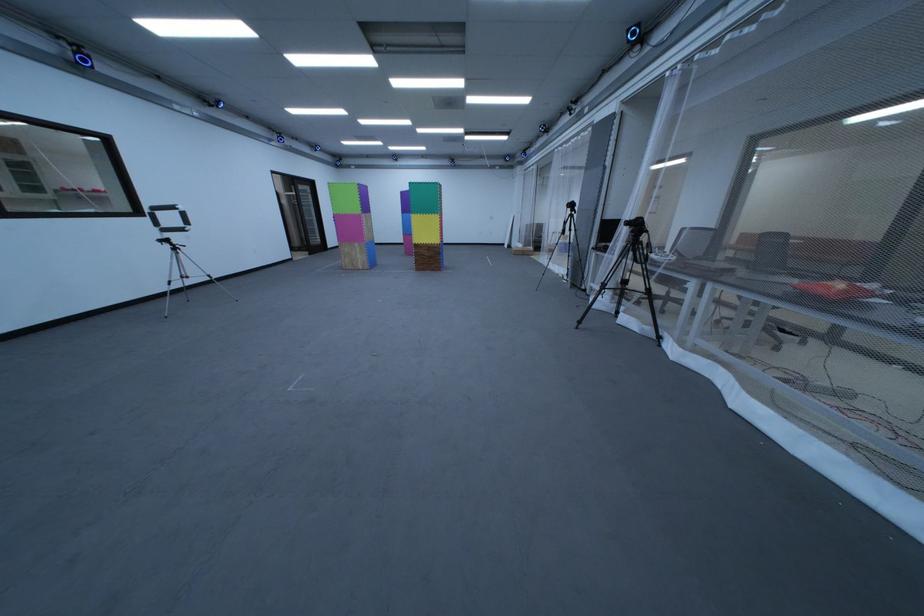
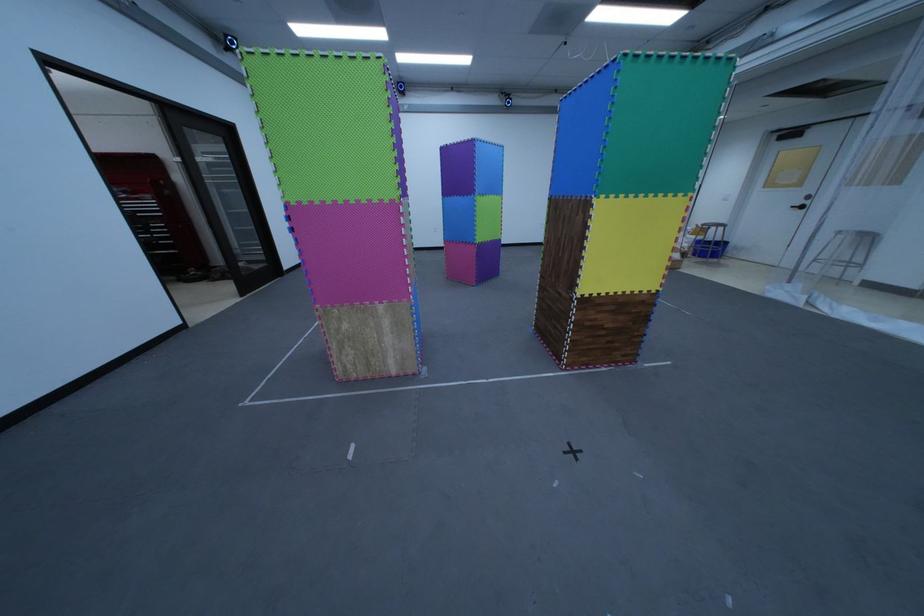
Locate, in the second image, the point that corresponds to the point at 546,249 in the first image.

(691, 257)